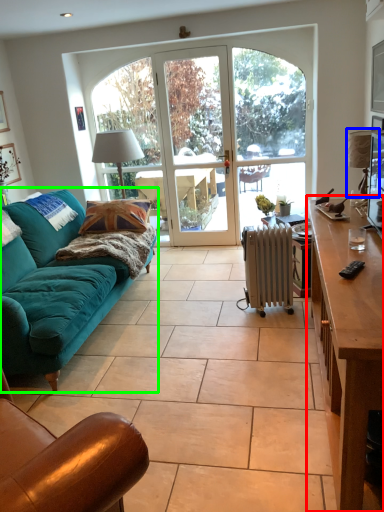
Question: Considering the real-world distances, which object is closest to desk (highlighted by a red box)? lamp (highlighted by a blue box) or studio couch (highlighted by a green box).

Choices:
 (A) lamp
 (B) studio couch

Answer: (A)